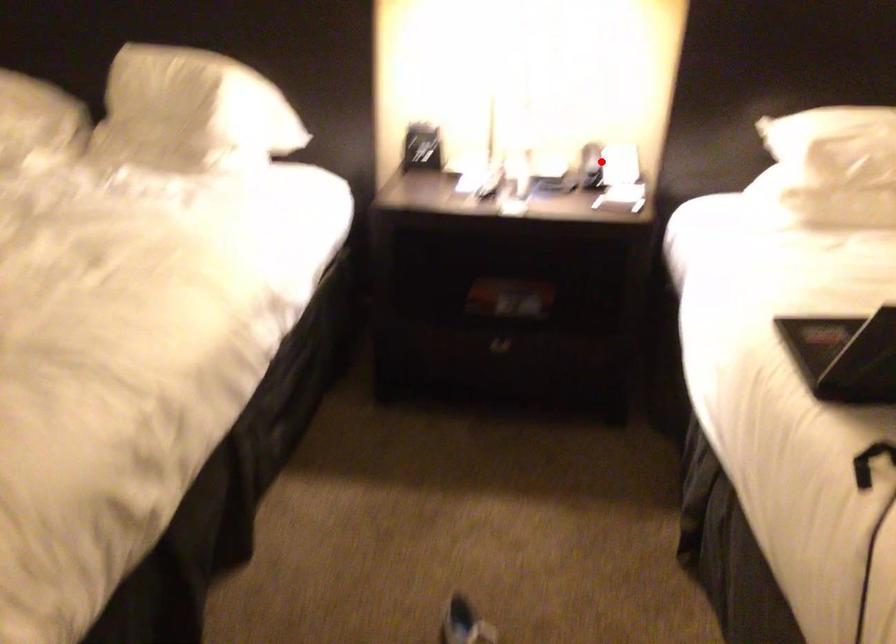
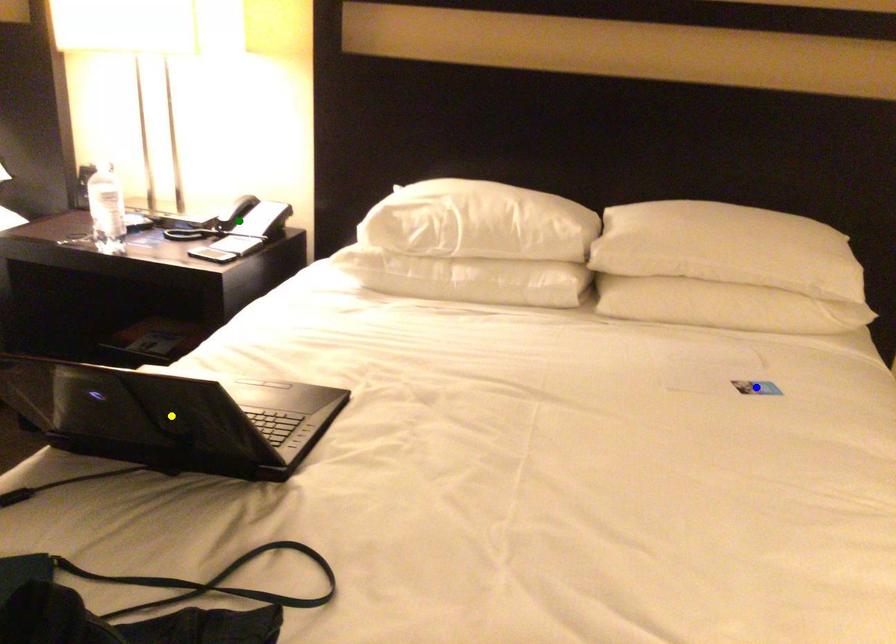
Question: I am providing you with two images of the same scene from different viewpoints. A red point is marked on the first image. You are given multiple points on the second image. Which mark in image 2 goes with the point in image 1?

Choices:
 (A) yellow point
 (B) green point
 (C) blue point

Answer: (B)